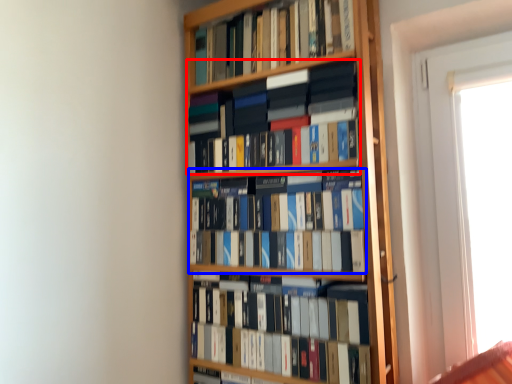
Question: Among these objects, which one is farthest to the camera, book (highlighted by a red box) or book (highlighted by a blue box)?

Choices:
 (A) book
 (B) book

Answer: (A)